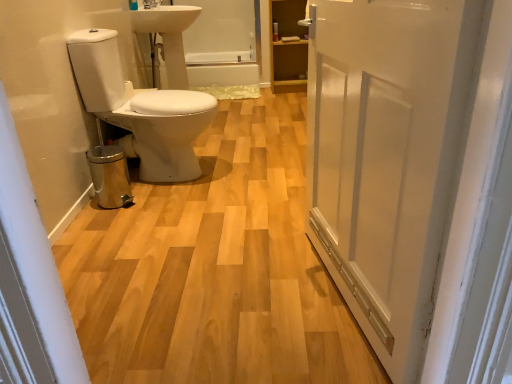
Question: Does wooden cabinet at upper right contain white glossy sink at upper center?

Choices:
 (A) yes
 (B) no

Answer: (B)

Question: Can you confirm if wooden cabinet at upper right is taller than white glossy sink at upper center?

Choices:
 (A) yes
 (B) no

Answer: (A)

Question: Does wooden cabinet at upper right come in front of white glossy sink at upper center?

Choices:
 (A) yes
 (B) no

Answer: (B)

Question: Does wooden cabinet at upper right appear on the left side of white glossy sink at upper center?

Choices:
 (A) no
 (B) yes

Answer: (A)

Question: Does wooden cabinet at upper right touch white glossy sink at upper center?

Choices:
 (A) no
 (B) yes

Answer: (A)

Question: Is wooden cabinet at upper right located outside white glossy sink at upper center?

Choices:
 (A) yes
 (B) no

Answer: (A)

Question: Is the depth of glossy ceramic tap at upper center less than that of white glossy toilet at left?

Choices:
 (A) yes
 (B) no

Answer: (B)

Question: From a real-world perspective, is glossy ceramic tap at upper center physically above white glossy toilet at left?

Choices:
 (A) yes
 (B) no

Answer: (A)

Question: Is glossy ceramic tap at upper center oriented away from white glossy toilet at left?

Choices:
 (A) yes
 (B) no

Answer: (B)

Question: Is glossy ceramic tap at upper center aimed at white glossy toilet at left?

Choices:
 (A) yes
 (B) no

Answer: (B)

Question: From a real-world perspective, is glossy ceramic tap at upper center located beneath white glossy toilet at left?

Choices:
 (A) no
 (B) yes

Answer: (A)

Question: Is glossy ceramic tap at upper center to the left of white glossy toilet at left from the viewer's perspective?

Choices:
 (A) yes
 (B) no

Answer: (A)

Question: From a real-world perspective, is white glossy bathtub at center below white glossy sink at upper center?

Choices:
 (A) no
 (B) yes

Answer: (B)